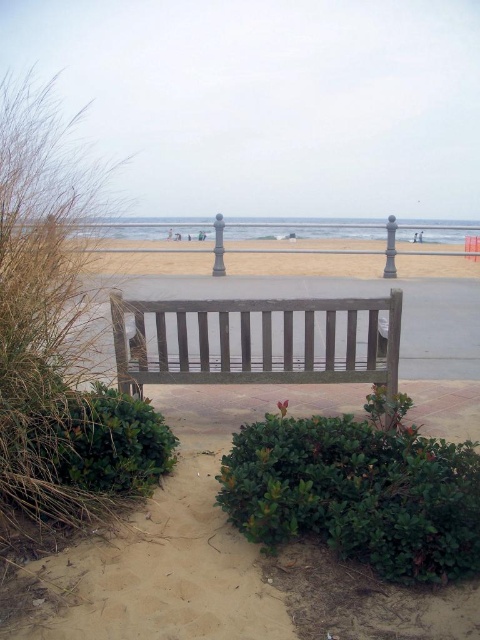
You are a painter setting up your easel on the beach. You want to place your easel on the wooden bench at center or the beige sand at center. Which surface is wider so that you can fit your large canvas?

The beige sand at center is wider than the wooden bench at center, so you should place your easel on the beige sand at center to accommodate your large canvas.

Looking at this image, you are standing at the entrance of the sandy pathway and want to reach the ocean. The wooden bench at center is in your way. Can you walk around it on either side? Please explain based on the bench and the path layout.

The wooden bench at center is positioned slightly off to the right and flanked by low green shrubs. The sandy path curves gently around the bench, leading towards the paved walkway. This indicates that you can walk around the bench on either side along the curved path to reach the ocean.

Based on the photo, you are a visitor carrying a small backpack and want to sit down on the wooden bench at center. However, you notice the beige sand at center nearby. Which surface is more suitable for placing your backpack temporarily?

The wooden bench at center is smaller than beige sand at center, so the beige sand at center is a more suitable surface for placing your backpack temporarily because it has a larger area.